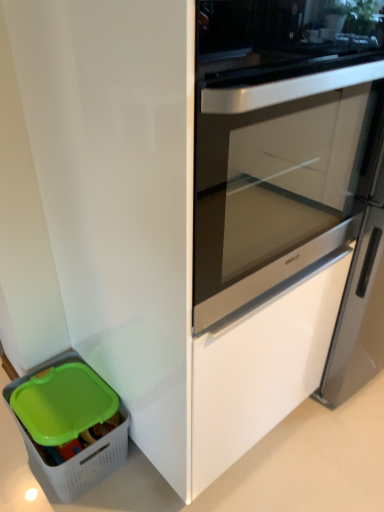
This screenshot has width=384, height=512. Describe the element at coordinates (281, 187) in the screenshot. I see `white glossy screen door at center` at that location.

This screenshot has height=512, width=384. I want to click on white glossy screen door at center, so click(281, 187).

Where is `white plastic basket at lower left`? Image resolution: width=384 pixels, height=512 pixels. white plastic basket at lower left is located at coordinates (79, 456).

Describe the element at coordinates (79, 456) in the screenshot. I see `white plastic basket at lower left` at that location.

Where is `white glossy screen door at center`? The height and width of the screenshot is (512, 384). white glossy screen door at center is located at coordinates (281, 187).

Which object is positioned more to the right, white glossy screen door at center or white plastic basket at lower left?

white glossy screen door at center.

Considering their positions, is white glossy screen door at center located in front of or behind white plastic basket at lower left?

Visually, white glossy screen door at center is located in front of white plastic basket at lower left.

Does point (220, 295) lie in front of point (77, 490)?

Yes, it is.

From the image's perspective, between white glossy screen door at center and white plastic basket at lower left, who is located below?

white plastic basket at lower left, from the image's perspective.

From a real-world perspective, is white glossy screen door at center positioned above or below white plastic basket at lower left?

white glossy screen door at center is situated higher than white plastic basket at lower left in the real world.

Which object is thinner, white glossy screen door at center or white plastic basket at lower left?

With smaller width is white glossy screen door at center.

Between white glossy screen door at center and white plastic basket at lower left, which one has less height?

With less height is white plastic basket at lower left.

Is white glossy screen door at center bigger or smaller than white plastic basket at lower left?

white glossy screen door at center is bigger than white plastic basket at lower left.

Can we say white glossy screen door at center lies outside white plastic basket at lower left?

That's correct, white glossy screen door at center is outside of white plastic basket at lower left.

Is white glossy screen door at center with white plastic basket at lower left?

No, white glossy screen door at center is not next to white plastic basket at lower left.

Is white glossy screen door at center turned away from white plastic basket at lower left?

No.

Can you tell me how much white glossy screen door at center and white plastic basket at lower left differ in facing direction?

white glossy screen door at center and white plastic basket at lower left are facing 87.9 degrees away from each other.

I want to click on screen door lying in front of the white plastic basket at lower left, so coord(281,187).

Between white plastic basket at lower left and white glossy screen door at center, which one appears on the left side from the viewer's perspective?

From the viewer's perspective, white plastic basket at lower left appears more on the left side.

From the picture: Considering the relative positions of white plastic basket at lower left and white glossy screen door at center in the image provided, is white plastic basket at lower left behind white glossy screen door at center?

Yes, the depth of white plastic basket at lower left is greater than that of white glossy screen door at center.

Does point (49, 481) appear closer or farther from the camera than point (243, 269)?

Clearly, point (49, 481) is more distant from the camera than point (243, 269).

From the image's perspective, who appears lower, white plastic basket at lower left or white glossy screen door at center?

white plastic basket at lower left, from the image's perspective.

From a real-world perspective, who is located higher, white plastic basket at lower left or white glossy screen door at center?

white glossy screen door at center, from a real-world perspective.

Which of these two, white plastic basket at lower left or white glossy screen door at center, is thinner?

With smaller width is white glossy screen door at center.

Looking at this image, is white plastic basket at lower left taller than white glossy screen door at center?

In fact, white plastic basket at lower left may be shorter than white glossy screen door at center.

Looking at the image, does white plastic basket at lower left seem bigger or smaller compared to white glossy screen door at center?

Considering their sizes, white plastic basket at lower left takes up less space than white glossy screen door at center.

Is white plastic basket at lower left inside or outside of white glossy screen door at center?

The correct answer is: outside.

Is white plastic basket at lower left with white glossy screen door at center?

No, white plastic basket at lower left is not beside white glossy screen door at center.

Could you tell me if white plastic basket at lower left is facing white glossy screen door at center?

No.

Based on the photo, what's the angular difference between white plastic basket at lower left and white glossy screen door at center's facing directions?

They differ by 87.9 degrees in their facing directions.

Measure the distance from white plastic basket at lower left to white glossy screen door at center.

white plastic basket at lower left and white glossy screen door at center are 30.59 inches apart.

Where is `storage box lying below the white glossy screen door at center (from the image's perspective)`? storage box lying below the white glossy screen door at center (from the image's perspective) is located at coordinates (79, 456).

The height and width of the screenshot is (512, 384). I want to click on storage box lying behind the white glossy screen door at center, so coord(79,456).

This screenshot has height=512, width=384. Find the location of `screen door lying on the right of white plastic basket at lower left`. screen door lying on the right of white plastic basket at lower left is located at coordinates (281, 187).